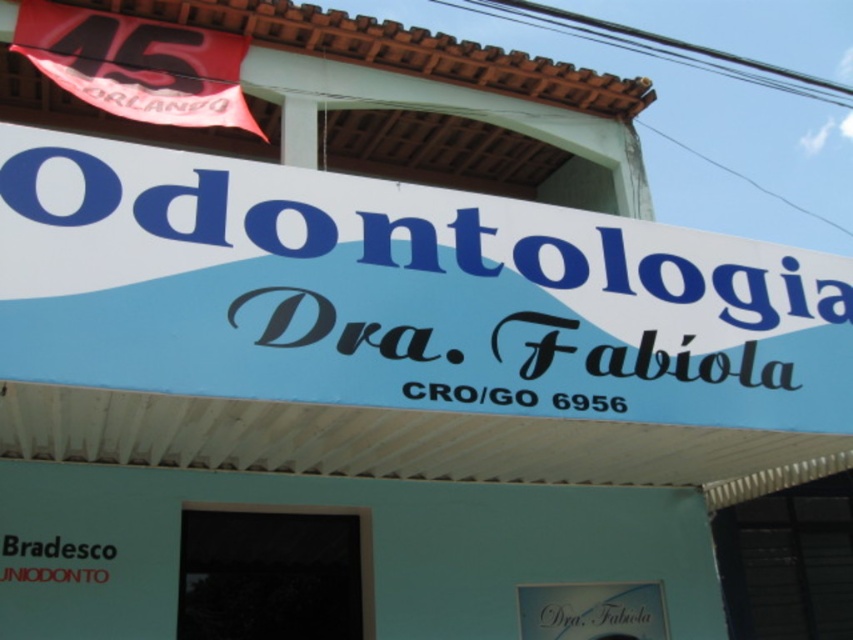
Does white plastic sign at center have a greater height compared to white glossy signboard at center?

Yes.

Who is shorter, white plastic sign at center or white glossy signboard at center?

white glossy signboard at center is shorter.

Does point (701, 396) lie behind point (635, 616)?

No, (701, 396) is in front of (635, 616).

Identify the location of white plastic sign at center. Image resolution: width=853 pixels, height=640 pixels. (399, 294).